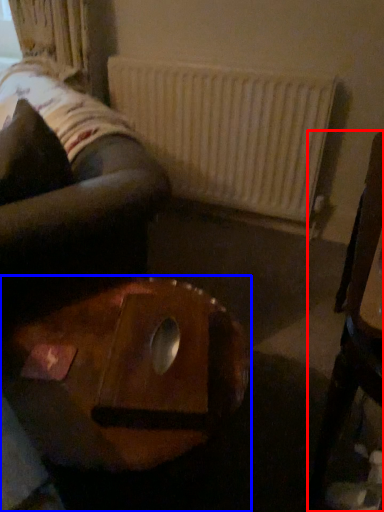
Question: Which of the following is the closest to the observer, furniture (highlighted by a red box) or table (highlighted by a blue box)?

Choices:
 (A) furniture
 (B) table

Answer: (A)